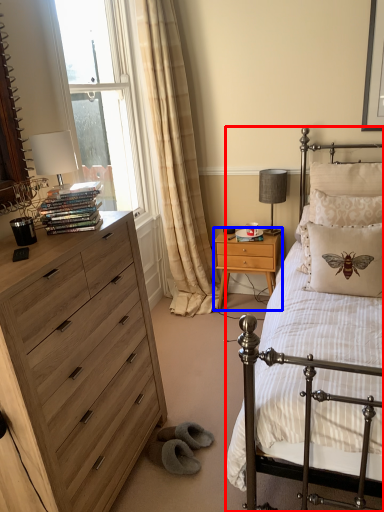
Question: Which object appears closest to the camera in this image, bed (highlighted by a red box) or nightstand (highlighted by a blue box)?

Choices:
 (A) bed
 (B) nightstand

Answer: (A)